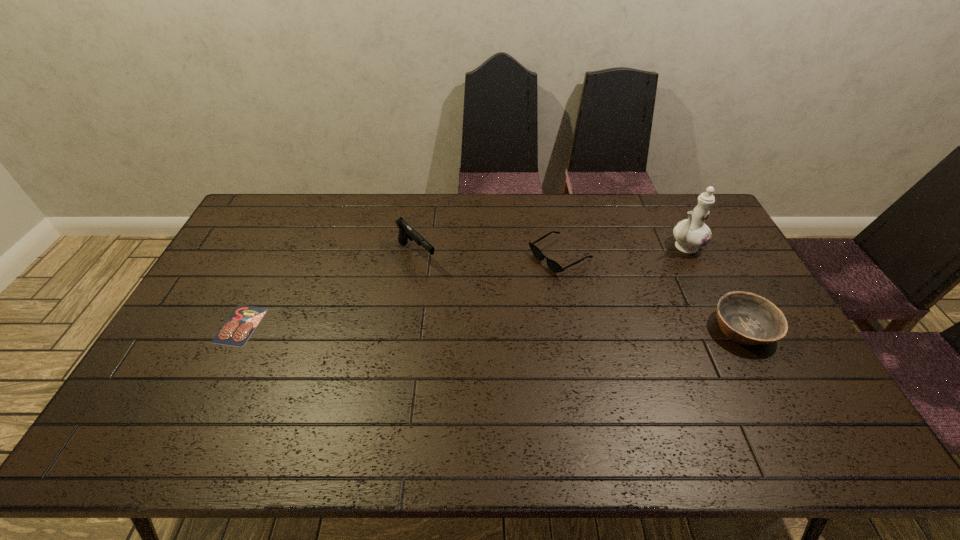
Where is `bowl present at the right edge`? bowl present at the right edge is located at coordinates (746, 318).

Where is `chinaware at the right edge`? The height and width of the screenshot is (540, 960). chinaware at the right edge is located at coordinates (692, 233).

Where is `vacant space at the far edge of the desktop`? vacant space at the far edge of the desktop is located at coordinates (455, 204).

Image resolution: width=960 pixels, height=540 pixels. Find the location of `vacant space at the near edge of the desktop`. vacant space at the near edge of the desktop is located at coordinates (623, 387).

This screenshot has height=540, width=960. Find the location of `free space at the right edge of the desktop`. free space at the right edge of the desktop is located at coordinates (794, 370).

This screenshot has height=540, width=960. What are the coordinates of `free space at the far left corner` in the screenshot? It's located at (277, 201).

Image resolution: width=960 pixels, height=540 pixels. In the image, there is a desktop. Identify the location of vacant area at the near left corner. (152, 380).

At what (x,y) coordinates should I click in order to perform the action: click on vacant area between the sunglasses and the tallest object. Please return your answer as a coordinate pair (x, y). Looking at the image, I should click on coord(622,251).

Find the location of a particular element. The image size is (960, 540). vacant space that is in between the second shortest object and the tallest object is located at coordinates (622, 251).

Locate an element on the screen. free space that is in between the third tallest object and the fourth shortest object is located at coordinates (580, 292).